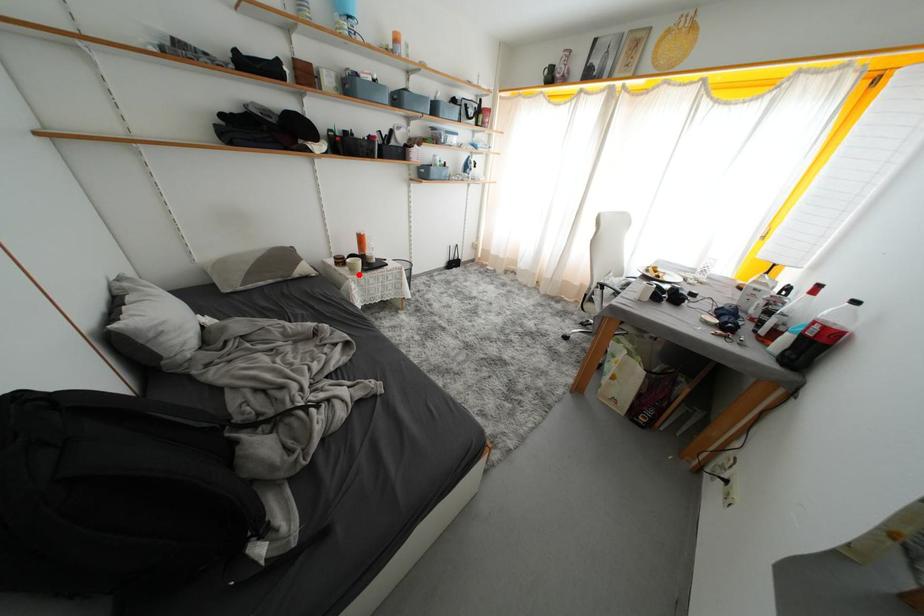
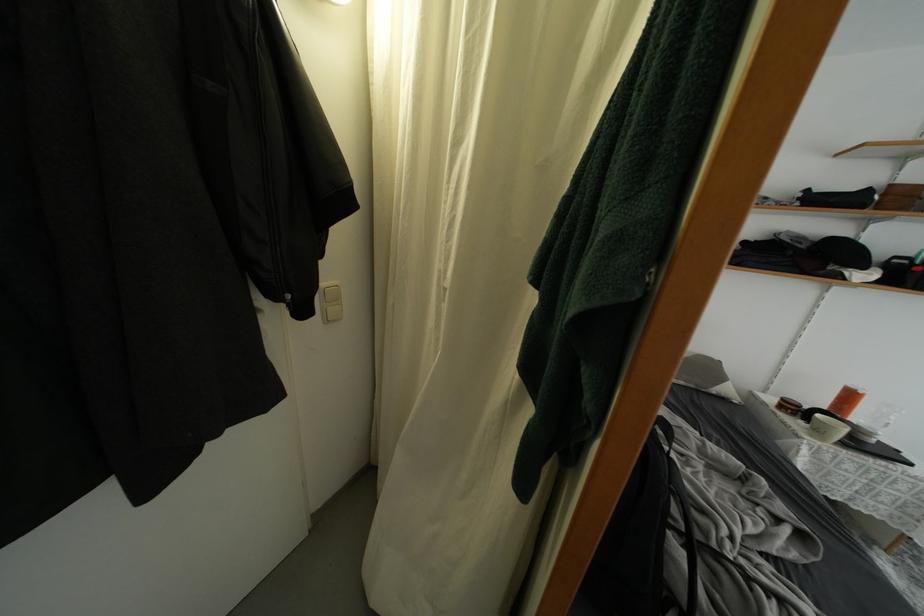
Question: I am providing you with two images of the same scene from different viewpoints. A red point is marked on the first image. At the location where the point appears in image 1, is it still visible in image 2?

Choices:
 (A) Yes
 (B) No

Answer: (A)